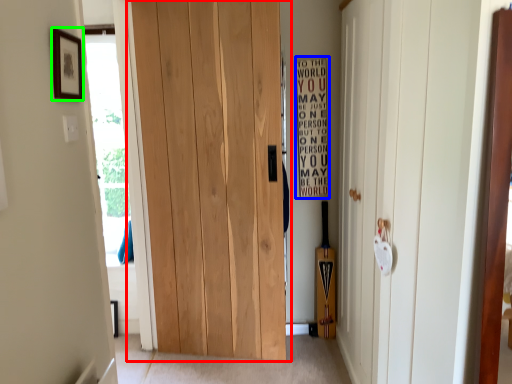
Question: Which is nearer to the door (highlighted by a red box)? bulletin board (highlighted by a blue box) or picture frame (highlighted by a green box).

Choices:
 (A) bulletin board
 (B) picture frame

Answer: (A)